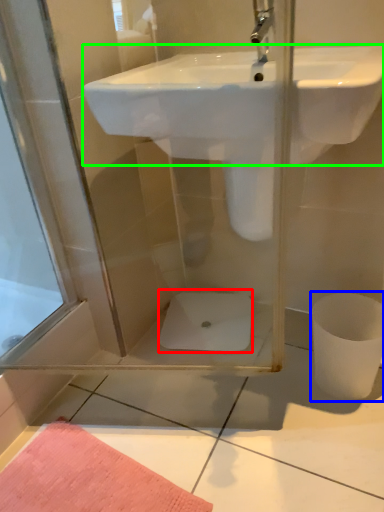
Question: Which object is the closest to the toilet bowl (highlighted by a red box)? Choose among these: toilet bowl (highlighted by a blue box) or sink (highlighted by a green box).

Choices:
 (A) toilet bowl
 (B) sink

Answer: (A)